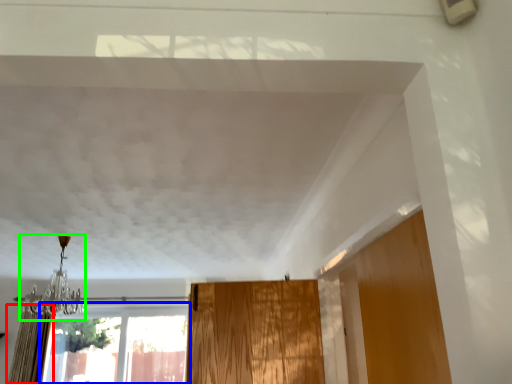
Question: Which is nearer to the curtain (highlighted by a red box)? window (highlighted by a blue box) or light fixture (highlighted by a green box).

Choices:
 (A) window
 (B) light fixture

Answer: (B)